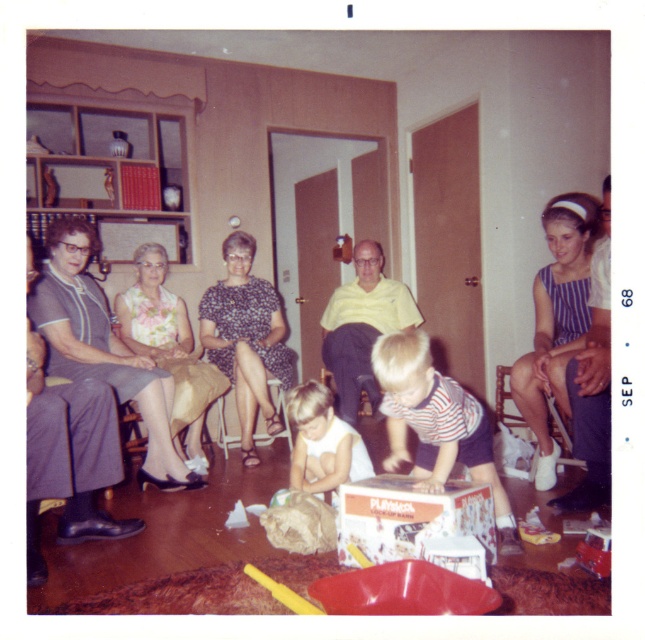
Question: Observing the image, what is the correct spatial positioning of white cardboard playmobil box at center in reference to yellow matte shirt at center?

Choices:
 (A) left
 (B) right

Answer: (B)

Question: Which object is positioned closest to the white cardboard playmobil box at center?

Choices:
 (A) matte gray dress at left
 (B) yellow matte shirt at center
 (C) printed fabric dress at center
 (D) striped cotton shirt at center

Answer: (D)

Question: Does printed fabric dress at center appear under floral-patterned dress at center?

Choices:
 (A) no
 (B) yes

Answer: (A)

Question: Considering the relative positions of matte black dress at left and white cardboard playmobil box at center in the image provided, where is matte black dress at left located with respect to white cardboard playmobil box at center?

Choices:
 (A) right
 (B) left

Answer: (A)

Question: Which point is farther from the camera taking this photo?

Choices:
 (A) (387, 481)
 (B) (303, 468)

Answer: (B)

Question: Which of the following is the farthest from the observer?

Choices:
 (A) matte black dress at left
 (B) white cardboard playmobil box at center
 (C) yellow matte shirt at center
 (D) striped fabric dress at right

Answer: (C)